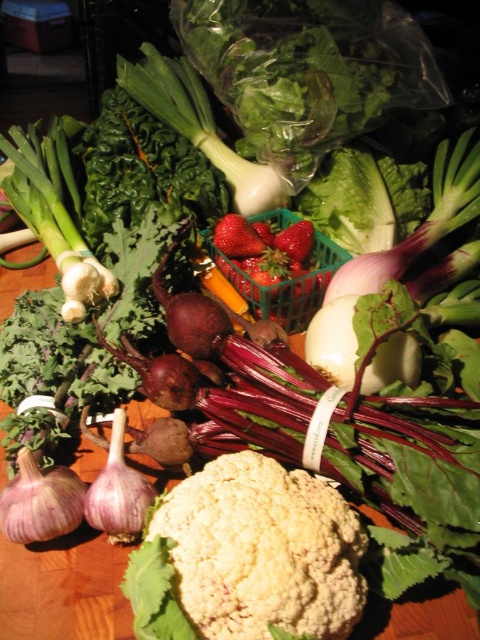
You are a photographer setting up a still life shoot with the white matte cauliflower at center. You want to ensure the cauliflower is in focus while keeping the background slightly blurred. If your camera has a depth of field setting that can blur objects beyond a certain distance, what minimum distance should you set the depth of field to achieve this effect?

The white matte cauliflower at center is 19.92 inches from the camera. To keep the background slightly blurred while focusing on the cauliflower, set the depth of field to a distance just beyond 19.92 inches so that objects further away become out of focus.

You are a chef preparing a dish and need to reach both the white matte cauliflower at center and the red matte strawberries at center. Which one can you grab first without moving your position?

The white matte cauliflower at center is closer to the viewer than the red matte strawberries at center, so you can grab the white matte cauliflower at center first without moving your position.

You are arranging fruits and vegetables on a table and want to place a new item between the green plastic basket at center and the purple matte garlic at lower left. Based on their positions, where should you place the new item?

The green plastic basket at center is above the purple matte garlic at lower left, so placing the new item between them would require positioning it below the basket and above the garlic.